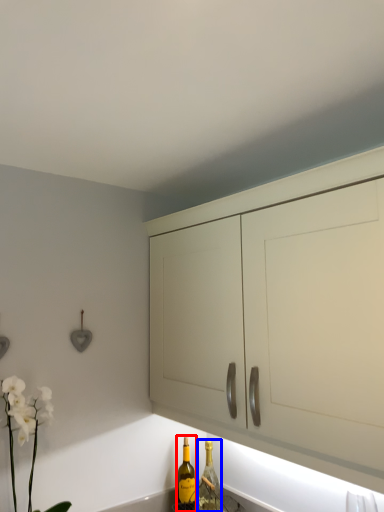
Question: Which object appears farthest to the camera in this image, bottle (highlighted by a red box) or bottle (highlighted by a blue box)?

Choices:
 (A) bottle
 (B) bottle

Answer: (B)